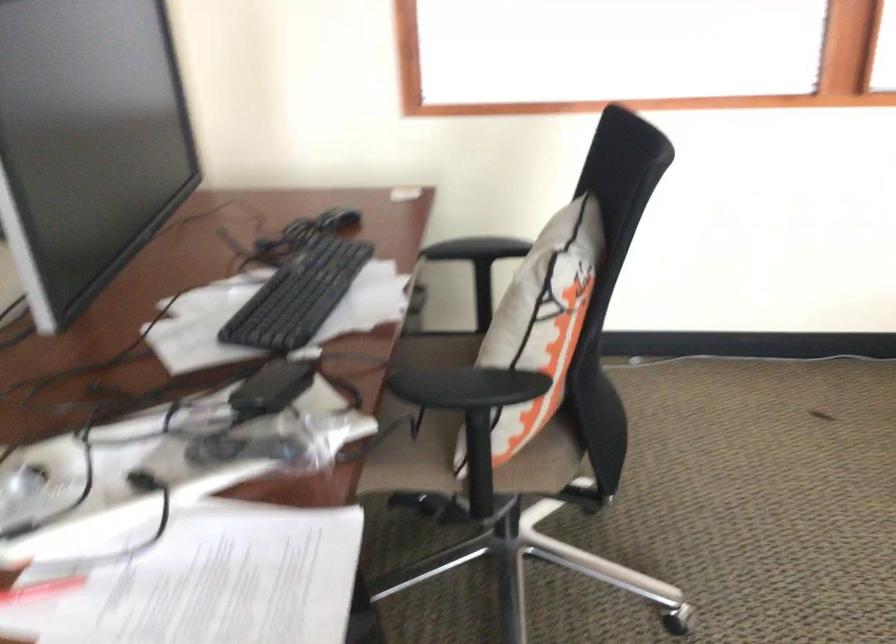
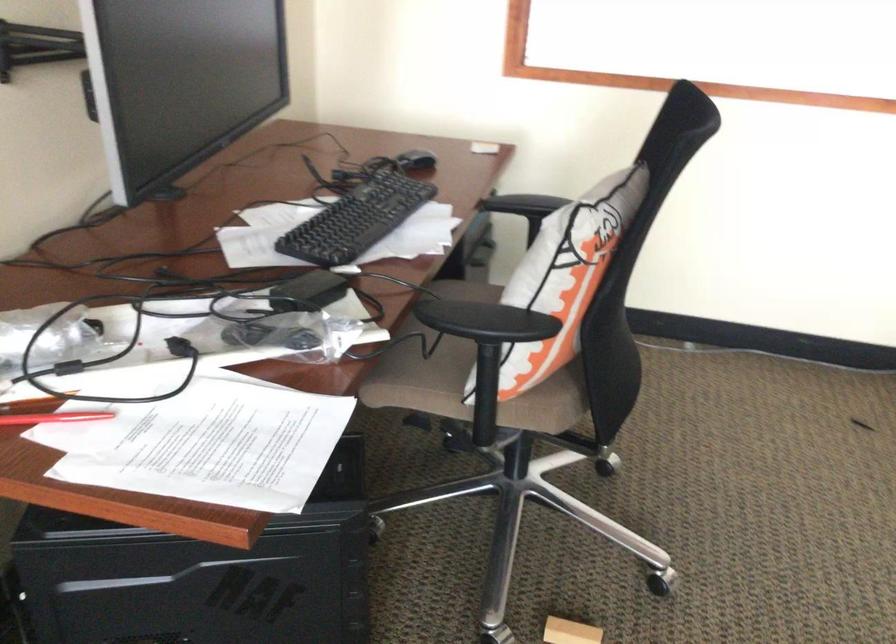
Locate, in the second image, the point that corresponds to (x=341, y=219) in the first image.

(416, 162)